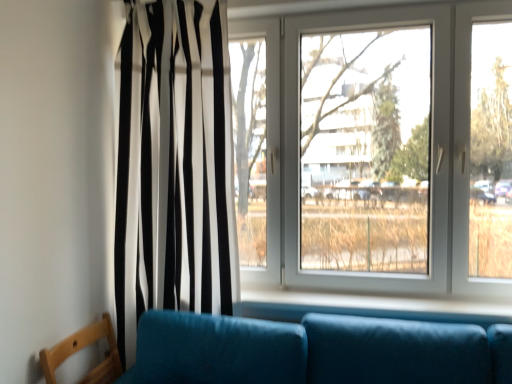
Question: Is the surface of white smooth window sill at lower center in direct contact with wooden chair at lower left?

Choices:
 (A) yes
 (B) no

Answer: (B)

Question: Considering the relative sizes of white smooth window sill at lower center and wooden chair at lower left in the image provided, is white smooth window sill at lower center taller than wooden chair at lower left?

Choices:
 (A) no
 (B) yes

Answer: (A)

Question: Is white smooth window sill at lower center completely or partially outside of wooden chair at lower left?

Choices:
 (A) yes
 (B) no

Answer: (A)

Question: Is white smooth window sill at lower center at the right side of wooden chair at lower left?

Choices:
 (A) yes
 (B) no

Answer: (A)

Question: Is white smooth window sill at lower center closer to the viewer compared to wooden chair at lower left?

Choices:
 (A) no
 (B) yes

Answer: (A)

Question: Considering the relative sizes of white smooth window sill at lower center and wooden chair at lower left in the image provided, is white smooth window sill at lower center smaller than wooden chair at lower left?

Choices:
 (A) no
 (B) yes

Answer: (B)

Question: Considering the relative sizes of white plastic window at center and white smooth window sill at lower center in the image provided, is white plastic window at center thinner than white smooth window sill at lower center?

Choices:
 (A) yes
 (B) no

Answer: (A)

Question: Is white plastic window at center further to the viewer compared to white smooth window sill at lower center?

Choices:
 (A) no
 (B) yes

Answer: (B)

Question: Considering the relative sizes of white plastic window at center and white smooth window sill at lower center in the image provided, is white plastic window at center wider than white smooth window sill at lower center?

Choices:
 (A) no
 (B) yes

Answer: (A)

Question: From the image's perspective, is white plastic window at center below white smooth window sill at lower center?

Choices:
 (A) no
 (B) yes

Answer: (A)

Question: From the image's perspective, would you say white plastic window at center is positioned over white smooth window sill at lower center?

Choices:
 (A) no
 (B) yes

Answer: (B)

Question: Is white plastic window at center taller than white smooth window sill at lower center?

Choices:
 (A) yes
 (B) no

Answer: (A)

Question: Does white plastic window at center have a smaller size compared to wooden chair at lower left?

Choices:
 (A) yes
 (B) no

Answer: (B)